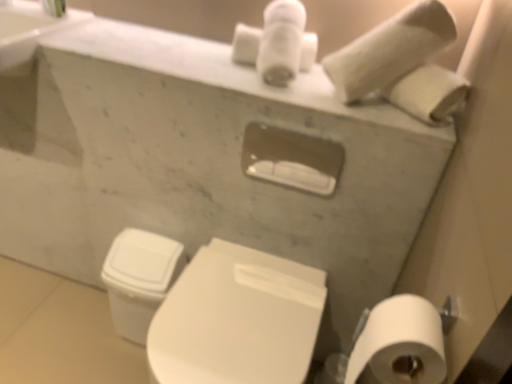
Question: Looking at the image, does white matte toilet paper at lower right, positioned as the 2th toilet paper in top-to-bottom order, seem bigger or smaller compared to white glossy toilet bowl at lower left?

Choices:
 (A) big
 (B) small

Answer: (B)

Question: Is white matte toilet paper at lower right, positioned as the first toilet paper in front-to-back order, inside or outside of white glossy toilet bowl at lower left?

Choices:
 (A) inside
 (B) outside

Answer: (B)

Question: Based on their relative distances, which object is farther from the white glossy toilet bowl at lower left?

Choices:
 (A) white matte toilet paper at upper right, marked as the first toilet paper in a top-to-bottom arrangement
 (B) white glossy toilet at lower center
 (C) white marble sink at upper left
 (D) white matte toilet paper at lower right, the 1th toilet paper positioned from the bottom

Answer: (A)

Question: Which object is the closest to the white matte toilet paper at lower right, positioned as the 2th toilet paper in back-to-front order?

Choices:
 (A) white glossy toilet bowl at lower left
 (B) white glossy toilet at lower center
 (C) white matte toilet paper at upper right, marked as the first toilet paper in a top-to-bottom arrangement
 (D) white marble sink at upper left

Answer: (B)